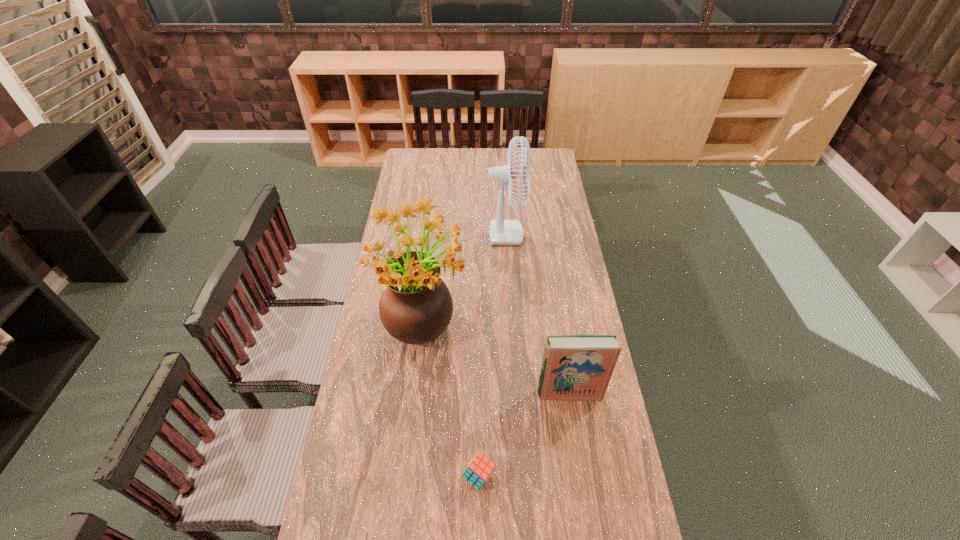
Image resolution: width=960 pixels, height=540 pixels. I want to click on object positioned at the left edge, so click(x=415, y=307).

Where is `object present at the right edge`? object present at the right edge is located at coordinates (575, 367).

Find the location of a particular element. vacant space at the left edge of the desktop is located at coordinates (420, 233).

Locate an element on the screen. vacant space at the right edge is located at coordinates (577, 256).

Locate an element on the screen. vacant space that is in between the flower arrangement and the nearest object is located at coordinates (452, 399).

Image resolution: width=960 pixels, height=540 pixels. In order to click on empty space between the flower arrangement and the nearest object in this screenshot , I will do `click(452, 399)`.

You are a GUI agent. You are given a task and a screenshot of the screen. Output one action in this format:
    pyautogui.click(x=<x>, y=<y>)
    Task: Click on the unoccupied area between the nearest object and the second shortest object
    The height and width of the screenshot is (540, 960).
    Given the screenshot: What is the action you would take?
    pyautogui.click(x=524, y=435)

You are a GUI agent. You are given a task and a screenshot of the screen. Output one action in this format:
    pyautogui.click(x=<x>, y=<y>)
    Task: Click on the empty space that is in between the shortest object and the third tallest object
    
    Given the screenshot: What is the action you would take?
    pyautogui.click(x=524, y=435)

Locate an element on the screen. This screenshot has width=960, height=540. free space between the hardback book and the nearest object is located at coordinates (524, 435).

Locate an element on the screen. vacant area between the flower arrangement and the shortest object is located at coordinates (452, 399).